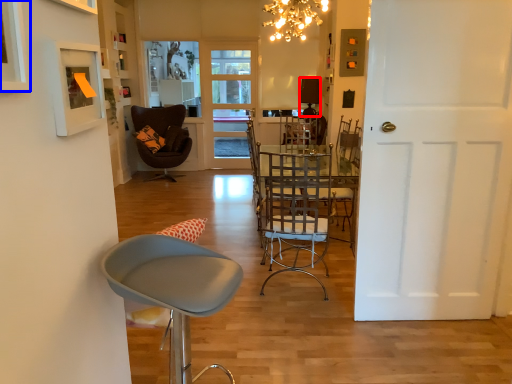
Question: Which of the following is the farthest to the observer, lamp (highlighted by a red box) or picture frame (highlighted by a blue box)?

Choices:
 (A) lamp
 (B) picture frame

Answer: (A)